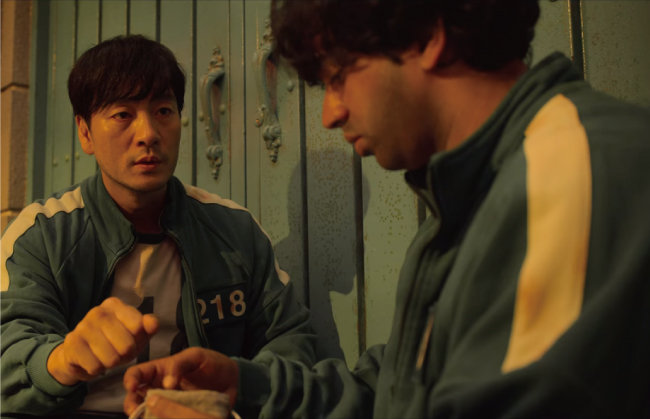
Locate an element on the screen. wall is located at coordinates (10, 33).